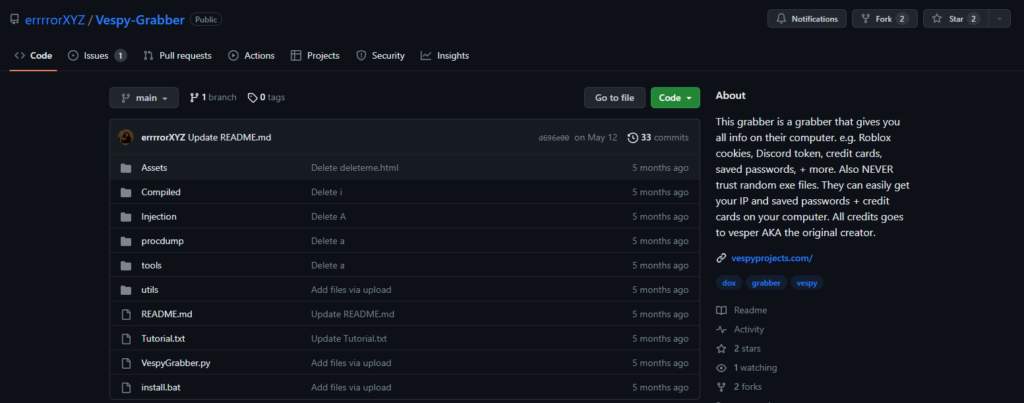
Image resolution: width=1024 pixels, height=403 pixels. Find the location of `documents`. documents is located at coordinates (121, 313), (121, 330), (125, 362), (121, 391).